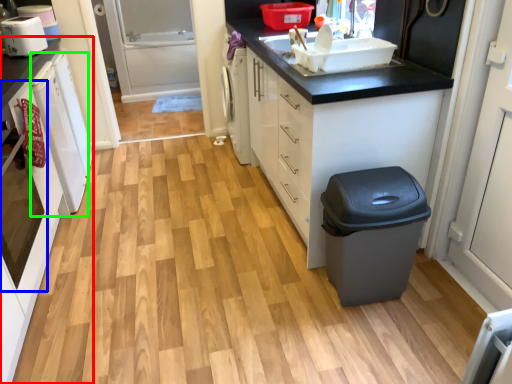
Question: Estimate the real-world distances between objects in this image. Which object is closer to cabinetry (highlighted by a red box), oven (highlighted by a blue box) or dish washer (highlighted by a green box)?

Choices:
 (A) oven
 (B) dish washer

Answer: (A)